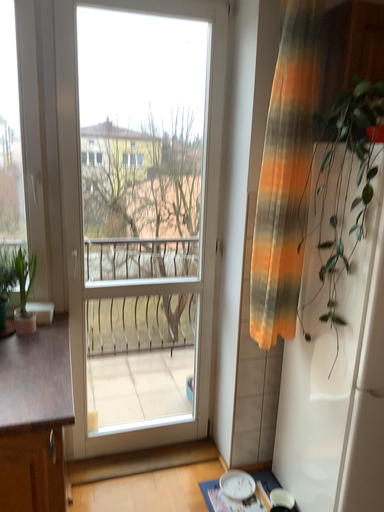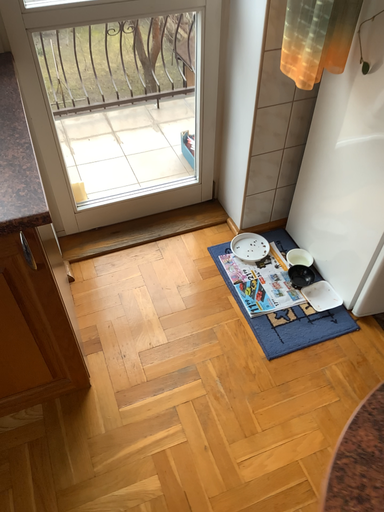
Question: Which way did the camera rotate in the video?

Choices:
 (A) rotated downward
 (B) rotated upward

Answer: (A)